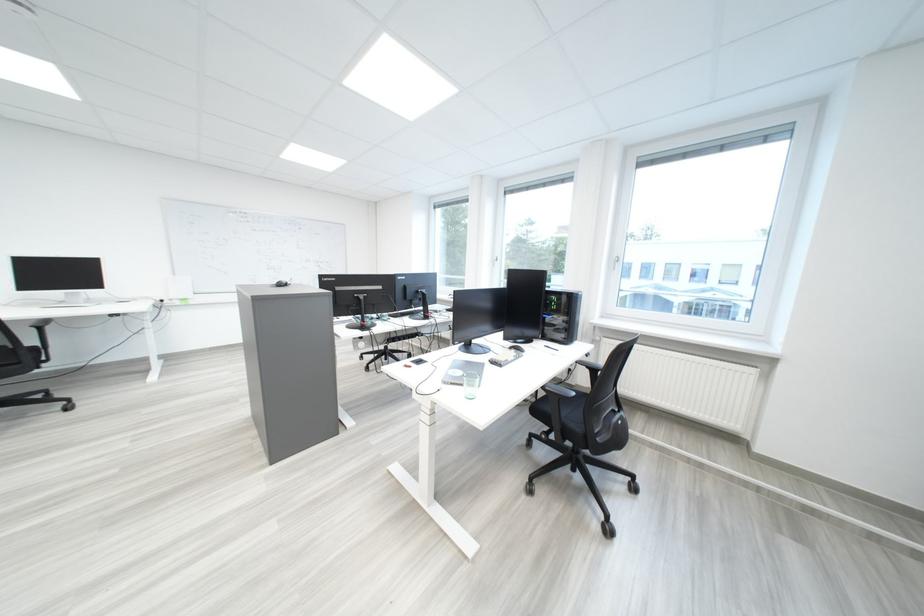
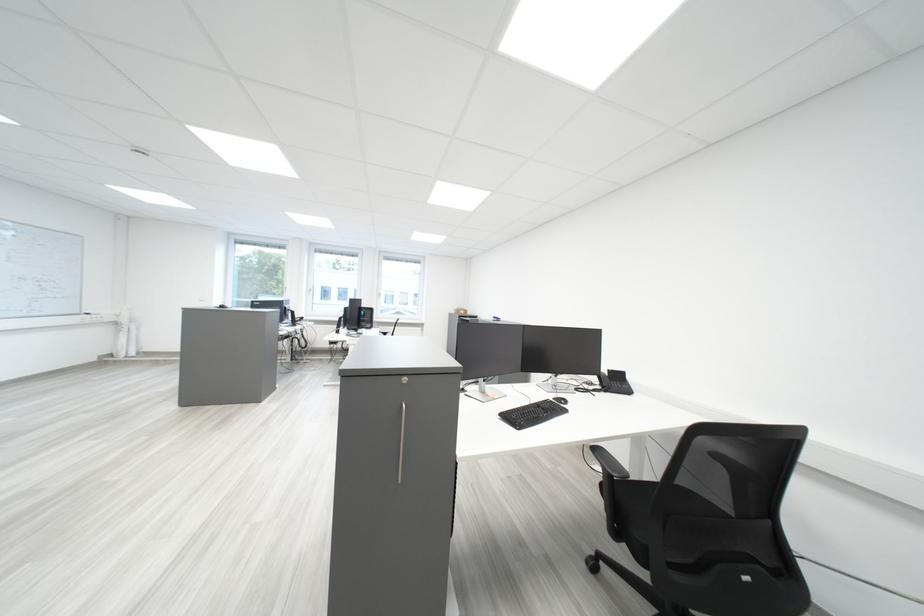
Question: I am providing you with two images of the same scene from different viewpoints. Please identify which objects are invisible in image2.

Choices:
 (A) chair armrest
 (B) black computer mouse
 (C) telephone handset
 (D) light colored hairbrush

Answer: (B)